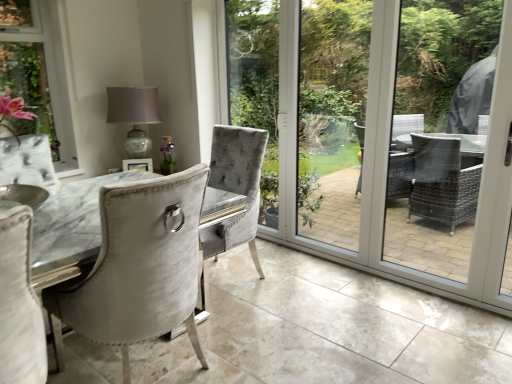
Where is `free area in between white glossy screen door at right, which ranks as the 1th screen door in right-to-left order, and satin white chair at center`? The width and height of the screenshot is (512, 384). free area in between white glossy screen door at right, which ranks as the 1th screen door in right-to-left order, and satin white chair at center is located at coordinates (335, 337).